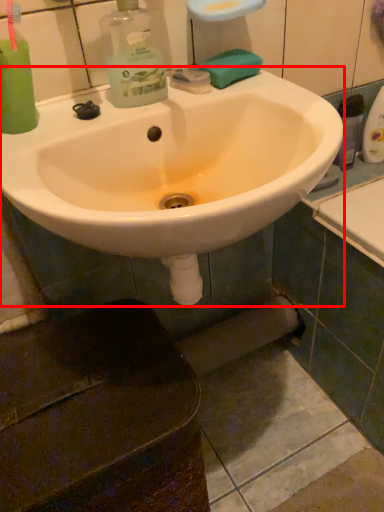
Question: From the image's perspective, considering the relative positions of sink (annotated by the red box) and soap in the image provided, where is sink (annotated by the red box) located with respect to the staircase?

Choices:
 (A) above
 (B) below

Answer: (B)